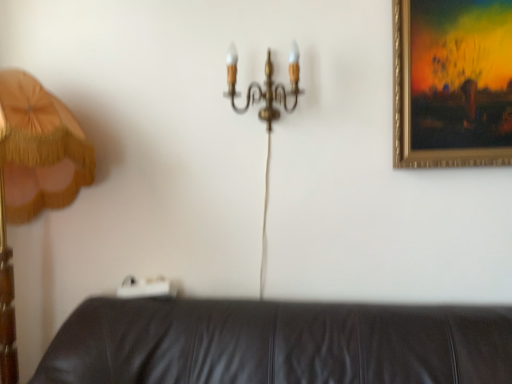
Question: Is wooden lampshade at left inside gold-framed painting at upper right?

Choices:
 (A) no
 (B) yes

Answer: (A)

Question: Is gold-framed painting at upper right wider than wooden lampshade at left?

Choices:
 (A) no
 (B) yes

Answer: (A)

Question: Can we say gold-framed painting at upper right lies outside wooden lampshade at left?

Choices:
 (A) no
 (B) yes

Answer: (B)

Question: Would you consider gold-framed painting at upper right to be distant from wooden lampshade at left?

Choices:
 (A) no
 (B) yes

Answer: (B)

Question: Considering the relative sizes of gold-framed painting at upper right and wooden lampshade at left in the image provided, is gold-framed painting at upper right thinner than wooden lampshade at left?

Choices:
 (A) no
 (B) yes

Answer: (B)

Question: Does point (239, 107) appear closer or farther from the camera than point (444, 117)?

Choices:
 (A) closer
 (B) farther

Answer: (B)

Question: Is gold metallic chandelier at upper center wider or thinner than gold-framed painting at upper right?

Choices:
 (A) wide
 (B) thin

Answer: (A)

Question: Considering the positions of gold metallic chandelier at upper center and gold-framed painting at upper right in the image, is gold metallic chandelier at upper center bigger or smaller than gold-framed painting at upper right?

Choices:
 (A) small
 (B) big

Answer: (A)

Question: From the image's perspective, is gold metallic chandelier at upper center positioned above or below gold-framed painting at upper right?

Choices:
 (A) below
 (B) above

Answer: (B)

Question: Is gold-framed painting at upper right in front of or behind wooden lampshade at left in the image?

Choices:
 (A) behind
 (B) front

Answer: (A)

Question: Considering the positions of gold-framed painting at upper right and wooden lampshade at left in the image, is gold-framed painting at upper right bigger or smaller than wooden lampshade at left?

Choices:
 (A) small
 (B) big

Answer: (A)

Question: Is point (472, 51) positioned closer to the camera than point (64, 140)?

Choices:
 (A) closer
 (B) farther

Answer: (A)

Question: Is gold-framed painting at upper right to the left or to the right of wooden lampshade at left in the image?

Choices:
 (A) left
 (B) right

Answer: (B)

Question: Looking at their shapes, would you say wooden lampshade at left is wider or thinner than gold metallic chandelier at upper center?

Choices:
 (A) wide
 (B) thin

Answer: (A)

Question: In the image, is wooden lampshade at left positioned in front of or behind gold metallic chandelier at upper center?

Choices:
 (A) behind
 (B) front

Answer: (B)